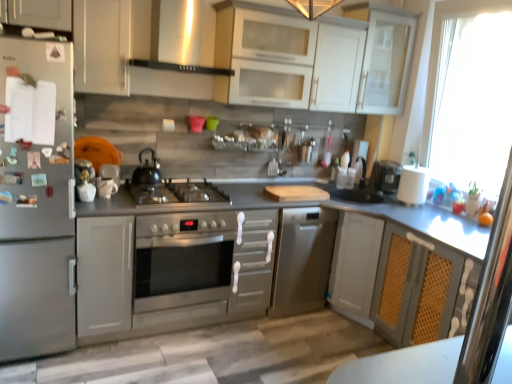
Measure the distance between white glossy cabinet at upper center, the third cabinetry in the bottom-to-top sequence, and camera.

8.66 feet.

What is the approximate height of white glossy coffee cup at center?

It is 5.10 inches.

What do you see at coordinates (182, 266) in the screenshot?
I see `stainless steel oven at center` at bounding box center [182, 266].

Find the location of `black matte exhaust hood at upper center`. black matte exhaust hood at upper center is located at coordinates (182, 38).

The image size is (512, 384). Describe the element at coordinates (182, 38) in the screenshot. I see `black matte exhaust hood at upper center` at that location.

Where is `satin gray cabinet at center, which ranks as the first cabinetry in left-to-right order`? This screenshot has height=384, width=512. satin gray cabinet at center, which ranks as the first cabinetry in left-to-right order is located at coordinates (104, 274).

Identify the location of screen door lying below the white glossy coffee cup at center (from the image's perspective). This screenshot has width=512, height=384. (490, 297).

Considering the relative sizes of clear glass screen door at right and white glossy coffee cup at center in the image provided, is clear glass screen door at right thinner than white glossy coffee cup at center?

Yes.

From the image's perspective, which object appears higher, clear glass screen door at right or white glossy coffee cup at center?

white glossy coffee cup at center appears higher in the image.

From a real-world perspective, is black matte kettle at center above or below transparent glass window at right?

Clearly, from a real-world perspective, black matte kettle at center is below transparent glass window at right.

Locate an element on the screen. This screenshot has width=512, height=384. window screen that appears above the black matte kettle at center (from a real-world perspective) is located at coordinates (473, 102).

Is black matte kettle at center situated inside transparent glass window at right or outside?

black matte kettle at center is spatially situated outside transparent glass window at right.

From the picture: Between black matte kettle at center and transparent glass window at right, which one has smaller size?

black matte kettle at center is smaller.

Considering the sizes of objects black matte kettle at center and clear glass screen door at right in the image provided, who is taller, black matte kettle at center or clear glass screen door at right?

clear glass screen door at right is taller.

From a real-world perspective, is black matte kettle at center positioned above or below clear glass screen door at right?

black matte kettle at center is below clear glass screen door at right.

Between black matte kettle at center and clear glass screen door at right, which one has larger width?

black matte kettle at center.

Between black matte kettle at center and clear glass screen door at right, which one has larger size?

With larger size is black matte kettle at center.

Which is behind, point (229, 291) or point (126, 314)?

Positioned behind is point (229, 291).

From the image's perspective, is stainless steel oven at center located above or below satin gray cabinet at center, marked as the third cabinetry in a right-to-left arrangement?

Based on their image positions, stainless steel oven at center is located beneath satin gray cabinet at center, marked as the third cabinetry in a right-to-left arrangement.

How different are the orientations of stainless steel oven at center and satin gray cabinet at center, which is counted as the 1th cabinetry, starting from the bottom, in degrees?

They differ by 0.648 degrees in their facing directions.

From a real-world perspective, who is located higher, stainless steel oven at center or satin gray cabinet at center, marked as the third cabinetry in a right-to-left arrangement?

satin gray cabinet at center, marked as the third cabinetry in a right-to-left arrangement.

Considering the relative positions of stainless steel oven at center and transparent glass cabinet at upper right in the image provided, is stainless steel oven at center to the left or to the right of transparent glass cabinet at upper right?

Based on their positions, stainless steel oven at center is located to the left of transparent glass cabinet at upper right.

Looking at this image, does stainless steel oven at center have a lesser height compared to transparent glass cabinet at upper right?

Yes, stainless steel oven at center is shorter than transparent glass cabinet at upper right.

Could you tell me if stainless steel oven at center is turned towards transparent glass cabinet at upper right?

No.

Which of these two, transparent glass window at right or transparent glass cabinet at upper right, stands shorter?

Standing shorter between the two is transparent glass cabinet at upper right.

From a real-world perspective, relative to transparent glass cabinet at upper right, is transparent glass window at right vertically above or below?

transparent glass window at right is situated lower than transparent glass cabinet at upper right in the real world.

Is point (487, 18) more distant than point (410, 49)?

No, (487, 18) is closer to viewer.

Can you confirm if transparent glass window at right is wider than transparent glass cabinet at upper right?

No, transparent glass window at right is not wider than transparent glass cabinet at upper right.

Is black matte kettle at center at the left side of white glossy cabinet at upper center, the third cabinetry in the bottom-to-top sequence?

Correct, you'll find black matte kettle at center to the left of white glossy cabinet at upper center, the third cabinetry in the bottom-to-top sequence.

Is point (158, 183) closer or farther from the camera than point (395, 82)?

Point (158, 183) is closer to the camera than point (395, 82).

From a real-world perspective, is black matte kettle at center under white glossy cabinet at upper center, the third cabinetry in the bottom-to-top sequence?

Yes.

Starting from the black matte kettle at center, which cabinetry is the 1st one in front? Please provide its 2D coordinates.

[(328, 56)]

Where is `screen door in front of the white glossy coffee cup at center`? The width and height of the screenshot is (512, 384). screen door in front of the white glossy coffee cup at center is located at coordinates (490, 297).

I want to click on window screen above the black matte kettle at center (from a real-world perspective), so [473, 102].

Estimate the real-world distances between objects in this image. Which object is closer to clear glass screen door at right, white matte cabinet at upper left, which is the second cabinetry from right to left, or white matte paper towel at right?

Based on the image, white matte cabinet at upper left, which is the second cabinetry from right to left, appears to be nearer to clear glass screen door at right.

Based on their spatial positions, is black matte exhaust hood at upper center or stainless steel oven at center closer to white glossy coffee cup at center?

stainless steel oven at center lies closer to white glossy coffee cup at center than the other object.

Estimate the real-world distances between objects in this image. Which object is further from satin gray cabinet at center, which ranks as the first cabinetry in left-to-right order, satin silver refrigerator at left or black matte kettle at center?

black matte kettle at center is positioned further to the anchor satin gray cabinet at center, which ranks as the first cabinetry in left-to-right order.

Which object lies further to the anchor point stainless steel oven at center, transparent glass cabinet at upper right or white glossy cabinet at upper center, the third cabinetry in the bottom-to-top sequence?

transparent glass cabinet at upper right is positioned further to the anchor stainless steel oven at center.

Based on their spatial positions, is black matte exhaust hood at upper center or black matte kettle at center further from transparent glass cabinet at upper right?

black matte kettle at center is positioned further to the anchor transparent glass cabinet at upper right.

Consider the image. From the image, which object appears to be farther from clear glass screen door at right, transparent glass window at right or satin silver refrigerator at left?

Among the two, transparent glass window at right is located further to clear glass screen door at right.

From the image, which object appears to be farther from white glossy cabinet at upper center, which is the first cabinetry in top-to-bottom order, black matte kettle at center or clear glass screen door at right?

clear glass screen door at right.

Based on their spatial positions, is white glossy coffee cup at center or clear glass screen door at right closer to transparent glass window at right?

white glossy coffee cup at center is positioned closer to the anchor transparent glass window at right.

Image resolution: width=512 pixels, height=384 pixels. I want to click on kitchen appliance situated between satin silver refrigerator at left and transparent glass window at right from left to right, so click(x=147, y=171).

Identify the location of appliance located between clear glass screen door at right and black matte kettle at center in the depth direction. The image size is (512, 384). (106, 187).

Identify the location of exhaust hood positioned between clear glass screen door at right and white matte paper towel at right from near to far. The image size is (512, 384). pyautogui.click(x=182, y=38).

Where is `exhaust hood between white glossy coffee cup at center and white matte paper towel at right`? exhaust hood between white glossy coffee cup at center and white matte paper towel at right is located at coordinates (182, 38).